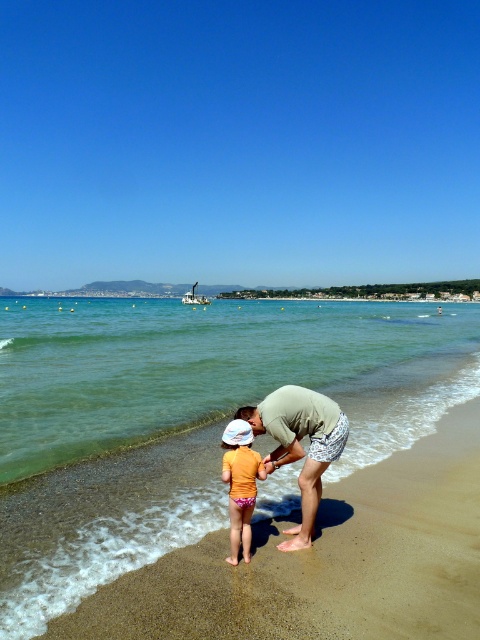
Question: Is clear blue water at lower center in front of light green fabric at center?

Choices:
 (A) yes
 (B) no

Answer: (B)

Question: Which of these objects is positioned closest to the orange fabric toddler at center?

Choices:
 (A) light green fabric at center
 (B) sandy beach at lower center
 (C) clear blue water at lower center

Answer: (A)

Question: Which point is farther to the camera?

Choices:
 (A) clear blue water at lower center
 (B) sandy beach at lower center

Answer: (A)

Question: Does clear blue water at lower center have a lesser width compared to light green fabric at center?

Choices:
 (A) no
 (B) yes

Answer: (A)

Question: Is clear blue water at lower center behind light green fabric at center?

Choices:
 (A) no
 (B) yes

Answer: (B)

Question: Among these objects, which one is farthest from the camera?

Choices:
 (A) orange fabric toddler at center
 (B) clear blue water at lower center
 (C) light green fabric at center
 (D) sandy beach at lower center

Answer: (B)